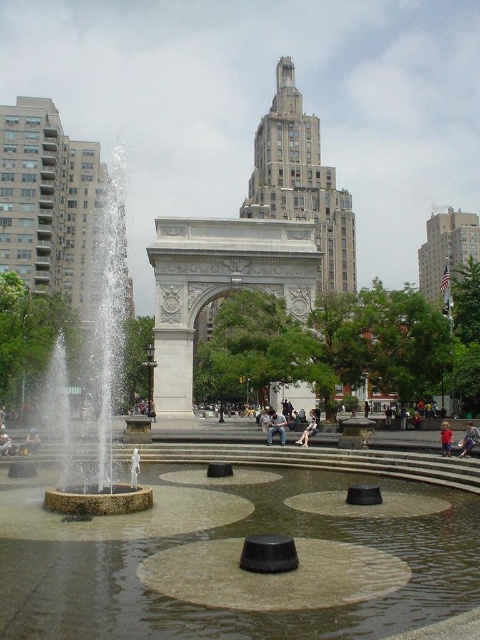
You are a photographer standing in the plaza and want to take a photo that includes both the denim jacket at center and the light blue denim jeans at lower left. To ensure both are in frame, should you pan your camera to the left or to the right?

You should pan your camera to the left because the denim jacket at center is to the right of the light blue denim jeans at lower left, so moving the camera left will include both items in the frame.

You are a photographer standing in the plaza and want to capture both the light brown leather jacket at center and the light blue denim jeans at lower left in the same frame. Which object should you focus on first to ensure both are in the shot?

The light brown leather jacket at center is located above the light blue denim jeans at lower left, so you should focus on the light blue denim jeans at lower left first to ensure both are in the shot.